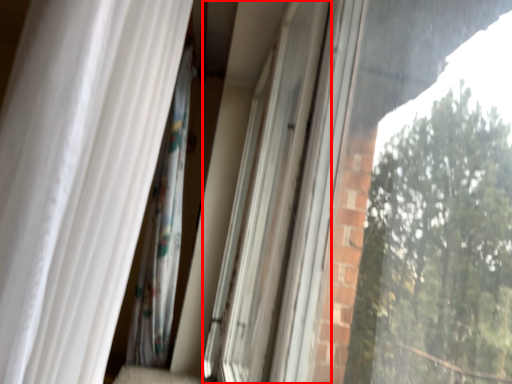
Question: Observing the image, what is the correct spatial positioning of screen door (annotated by the red box) in reference to curtain?

Choices:
 (A) left
 (B) right

Answer: (B)